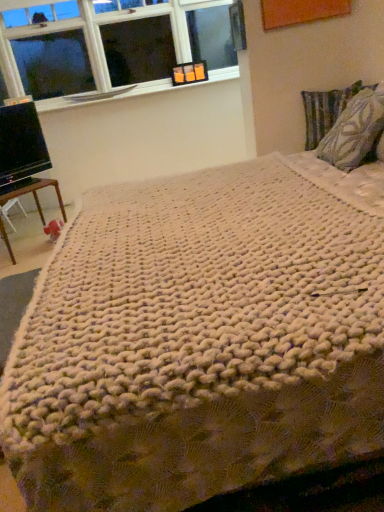
Question: Is clear glass window at upper left oriented away from brown wooden table at lower left?

Choices:
 (A) yes
 (B) no

Answer: (B)

Question: From the image's perspective, is clear glass window at upper left on top of brown wooden table at lower left?

Choices:
 (A) no
 (B) yes

Answer: (B)

Question: Can we say clear glass window at upper left lies outside brown wooden table at lower left?

Choices:
 (A) yes
 (B) no

Answer: (A)

Question: Does clear glass window at upper left have a greater width compared to brown wooden table at lower left?

Choices:
 (A) no
 (B) yes

Answer: (A)

Question: Is clear glass window at upper left taller than brown wooden table at lower left?

Choices:
 (A) no
 (B) yes

Answer: (B)

Question: Considering their positions, is textured fabric pillow at upper right, placed as the 2th pillow when sorted from front to back, located in front of or behind brown wooden table at lower left?

Choices:
 (A) front
 (B) behind

Answer: (B)

Question: Based on their sizes in the image, would you say textured fabric pillow at upper right, arranged as the 1th pillow when viewed from the back, is bigger or smaller than brown wooden table at lower left?

Choices:
 (A) big
 (B) small

Answer: (B)

Question: Is textured fabric pillow at upper right, placed as the 2th pillow when sorted from front to back, to the left or to the right of brown wooden table at lower left in the image?

Choices:
 (A) right
 (B) left

Answer: (A)

Question: Looking at their shapes, would you say textured fabric pillow at upper right, placed as the 2th pillow when sorted from front to back, is wider or thinner than brown wooden table at lower left?

Choices:
 (A) wide
 (B) thin

Answer: (B)

Question: From their relative heights in the image, would you say clear glass window at upper left is taller or shorter than textured fabric pillow at upper right, arranged as the 1th pillow when viewed from the back?

Choices:
 (A) short
 (B) tall

Answer: (B)

Question: Based on their sizes in the image, would you say clear glass window at upper left is bigger or smaller than textured fabric pillow at upper right, placed as the 2th pillow when sorted from front to back?

Choices:
 (A) big
 (B) small

Answer: (A)

Question: Looking at their shapes, would you say clear glass window at upper left is wider or thinner than textured fabric pillow at upper right, placed as the 2th pillow when sorted from front to back?

Choices:
 (A) wide
 (B) thin

Answer: (A)

Question: From the image's perspective, is clear glass window at upper left located above or below textured fabric pillow at upper right, placed as the 2th pillow when sorted from front to back?

Choices:
 (A) above
 (B) below

Answer: (A)

Question: From a real-world perspective, is clear glass window at upper left above or below patterned fabric pillow at right, the first pillow when ordered from front to back?

Choices:
 (A) above
 (B) below

Answer: (A)

Question: In terms of height, does clear glass window at upper left look taller or shorter compared to patterned fabric pillow at right, the first pillow when ordered from front to back?

Choices:
 (A) tall
 (B) short

Answer: (A)